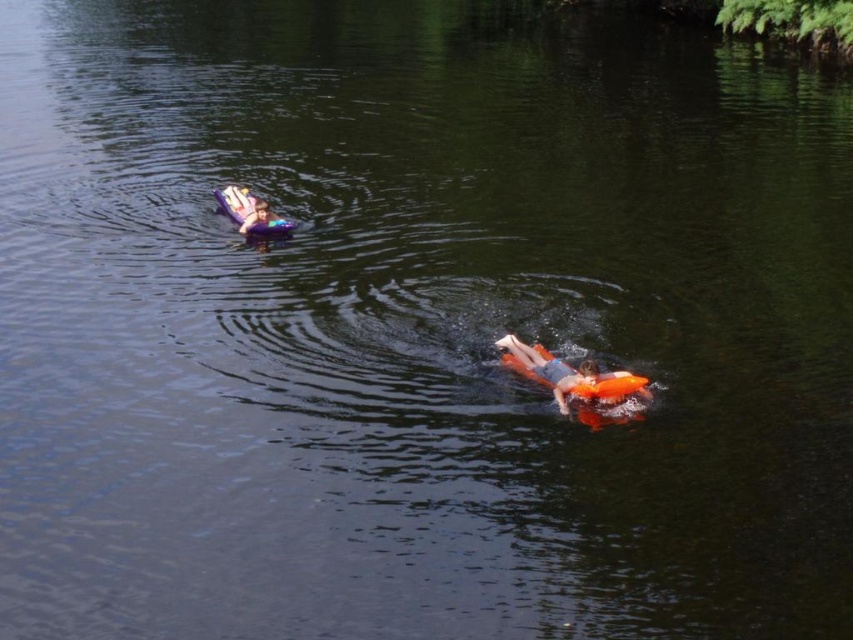
Question: Estimate the real-world distances between objects in this image. Which object is closer to the orange life vest at upper center?

Choices:
 (A) purple foam kayak at upper left
 (B) orange foam at center

Answer: (A)

Question: Is orange foam at center wider than purple foam kayak at upper left?

Choices:
 (A) no
 (B) yes

Answer: (B)

Question: Can you confirm if purple foam kayak at upper left is bigger than orange life vest at upper center?

Choices:
 (A) yes
 (B) no

Answer: (A)

Question: Among these objects, which one is nearest to the camera?

Choices:
 (A) purple foam kayak at upper left
 (B) orange foam at center

Answer: (B)

Question: Does orange foam at center appear on the left side of purple foam kayak at upper left?

Choices:
 (A) yes
 (B) no

Answer: (B)

Question: Which of these objects is positioned closest to the orange foam at center?

Choices:
 (A) orange life vest at upper center
 (B) purple foam kayak at upper left

Answer: (A)